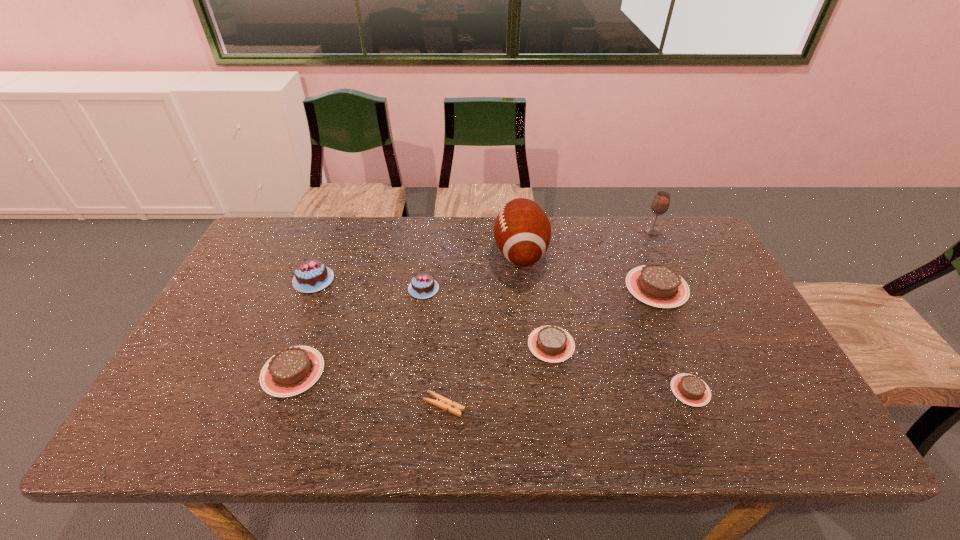
In order to click on the third chocolate cake from right to left in this screenshot , I will do `click(552, 344)`.

Where is `the fifth tallest chocolate cake`? Image resolution: width=960 pixels, height=540 pixels. the fifth tallest chocolate cake is located at coordinates (552, 344).

Identify the location of the smallest brown chocolate cake. (690, 389).

Where is `the shortest chocolate cake`? Image resolution: width=960 pixels, height=540 pixels. the shortest chocolate cake is located at coordinates (690, 389).

Image resolution: width=960 pixels, height=540 pixels. Identify the location of the shortest object. (441, 402).

The width and height of the screenshot is (960, 540). Find the location of `vacant space located on the laces of the football`. vacant space located on the laces of the football is located at coordinates (380, 253).

I want to click on vacant area located on the laces of the football, so 393,253.

Find the location of `vacant space situated 0.340m on the laces of the football`. vacant space situated 0.340m on the laces of the football is located at coordinates pyautogui.click(x=387, y=253).

What are the coordinates of `vacant position located on the left of the second tallest object` in the screenshot? It's located at (612, 231).

Image resolution: width=960 pixels, height=540 pixels. In order to click on vacant area located 0.340m on the front of the tallest chocolate cake in this screenshot , I will do `click(267, 399)`.